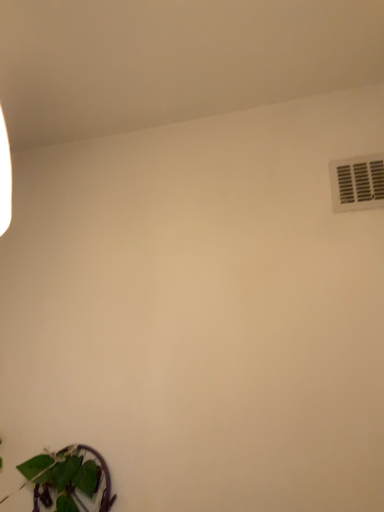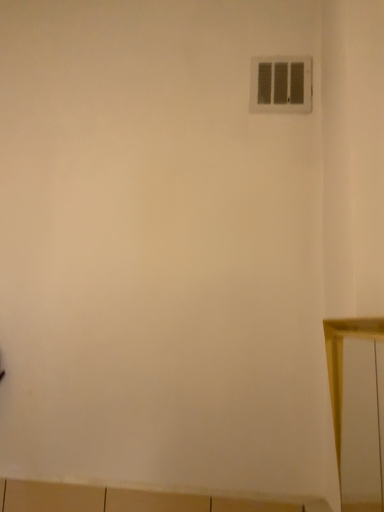
Question: How did the camera likely rotate when shooting the video?

Choices:
 (A) rotated left
 (B) rotated right

Answer: (B)